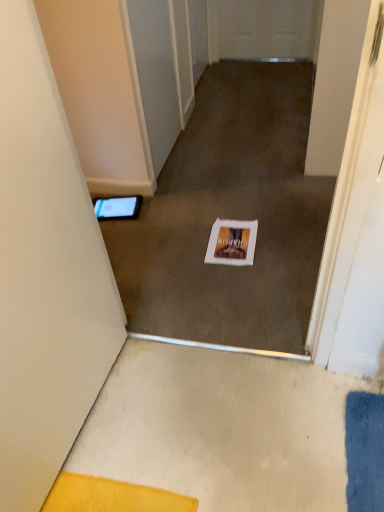
Locate an element on the screen. This screenshot has width=384, height=512. vacant area in front of white paper at center is located at coordinates (238, 284).